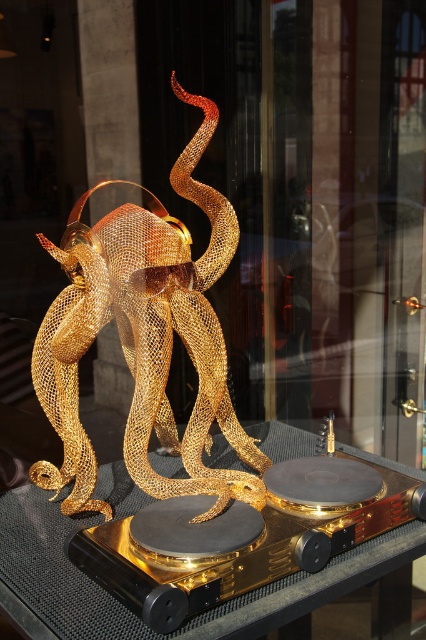
You are a photographer setting up a shoot. You need to ensure that the gold mesh octopus at center is visible without any obstruction. Since the transparent glass table at center is in the scene, will the octopus be clearly visible through the glass table?

The gold mesh octopus at center is above the transparent glass table at center, so the octopus will be clearly visible through the glass table as there is no obstruction between them.

You are an interior designer planning to place a new decorative item on the transparent glass table at center. Considering the size of the gold mesh octopus at center, will the table be able to accommodate the octopus without any part hanging off the edges?

The gold mesh octopus at center is larger in size than the transparent glass table at center, so placing it on the table would cause parts of the octopus to hang off the edges. A larger table is needed to accommodate it properly.

You are a delivery person who needs to place a large package on the transparent glass table at center. However, there is already a gold mesh octopus at center on the table. Can you place the package on the table without moving the octopus?

The gold mesh octopus at center is taller than the transparent glass table at center, so placing the package on the table might be difficult as the octopus might block the space above the table.